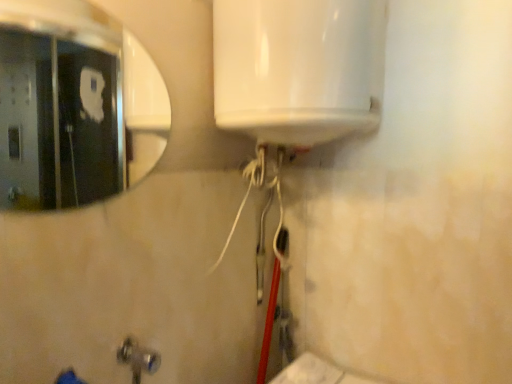
Question: Can you confirm if silver/metallic mirror at upper left is shorter than brushed metal faucet at lower left?

Choices:
 (A) yes
 (B) no

Answer: (B)

Question: Is silver/metallic mirror at upper left wider than brushed metal faucet at lower left?

Choices:
 (A) no
 (B) yes

Answer: (A)

Question: From a real-world perspective, is silver/metallic mirror at upper left positioned over brushed metal faucet at lower left based on gravity?

Choices:
 (A) yes
 (B) no

Answer: (A)

Question: Considering the relative sizes of silver/metallic mirror at upper left and brushed metal faucet at lower left in the image provided, is silver/metallic mirror at upper left bigger than brushed metal faucet at lower left?

Choices:
 (A) no
 (B) yes

Answer: (A)

Question: Is silver/metallic mirror at upper left surrounding brushed metal faucet at lower left?

Choices:
 (A) no
 (B) yes

Answer: (A)

Question: Is the position of silver/metallic mirror at upper left less distant than that of brushed metal faucet at lower left?

Choices:
 (A) yes
 (B) no

Answer: (B)

Question: Does brushed metal faucet at lower left have a larger size compared to silver/metallic mirror at upper left?

Choices:
 (A) yes
 (B) no

Answer: (A)

Question: From a real-world perspective, is brushed metal faucet at lower left below silver/metallic mirror at upper left?

Choices:
 (A) yes
 (B) no

Answer: (A)

Question: Considering the relative sizes of brushed metal faucet at lower left and silver/metallic mirror at upper left in the image provided, is brushed metal faucet at lower left wider than silver/metallic mirror at upper left?

Choices:
 (A) yes
 (B) no

Answer: (A)

Question: Is brushed metal faucet at lower left at the right side of silver/metallic mirror at upper left?

Choices:
 (A) no
 (B) yes

Answer: (B)

Question: From the image's perspective, is brushed metal faucet at lower left on top of silver/metallic mirror at upper left?

Choices:
 (A) yes
 (B) no

Answer: (B)

Question: Does brushed metal faucet at lower left have a lesser height compared to silver/metallic mirror at upper left?

Choices:
 (A) yes
 (B) no

Answer: (A)

Question: From the image's perspective, is brushed metal faucet at lower left positioned above or below silver/metallic mirror at upper left?

Choices:
 (A) above
 (B) below

Answer: (B)